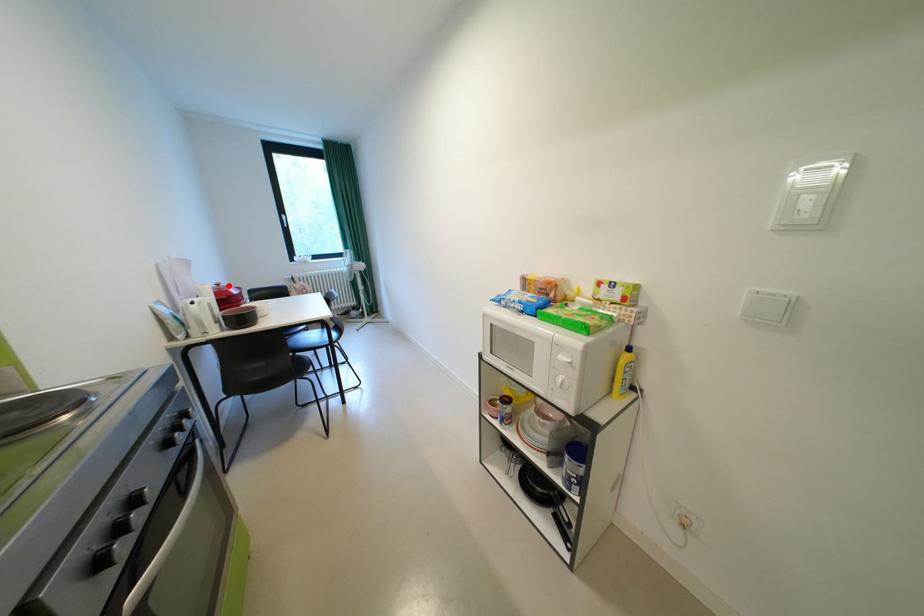
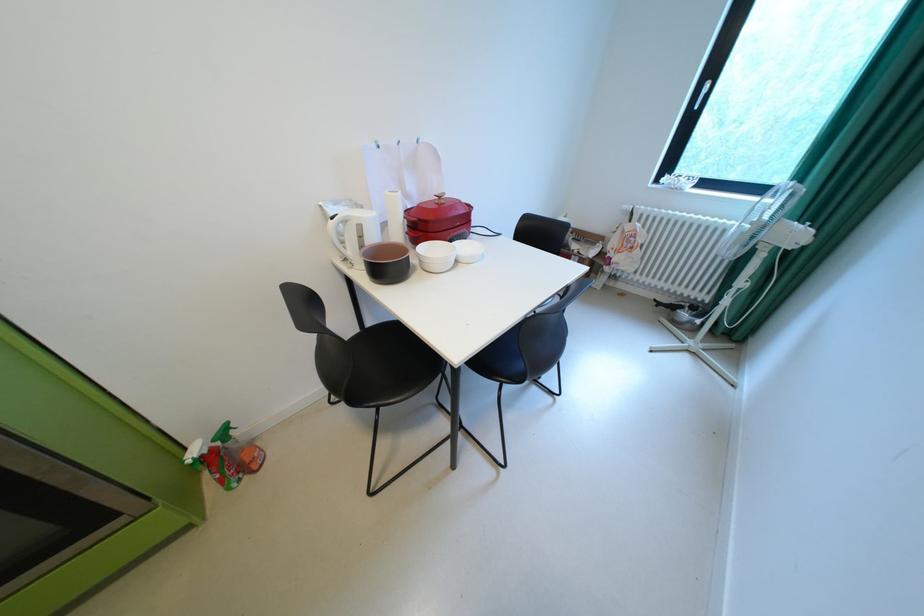
The point at the highlighted location is marked in the first image. Where is the corresponding point in the second image?

(450, 198)